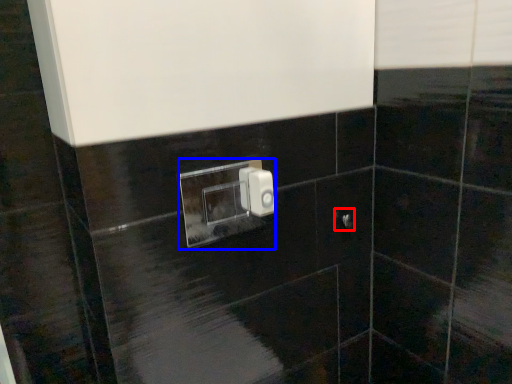
Question: Which of the following is the closest to the observer, door handle (highlighted by a red box) or light switch (highlighted by a blue box)?

Choices:
 (A) door handle
 (B) light switch

Answer: (B)